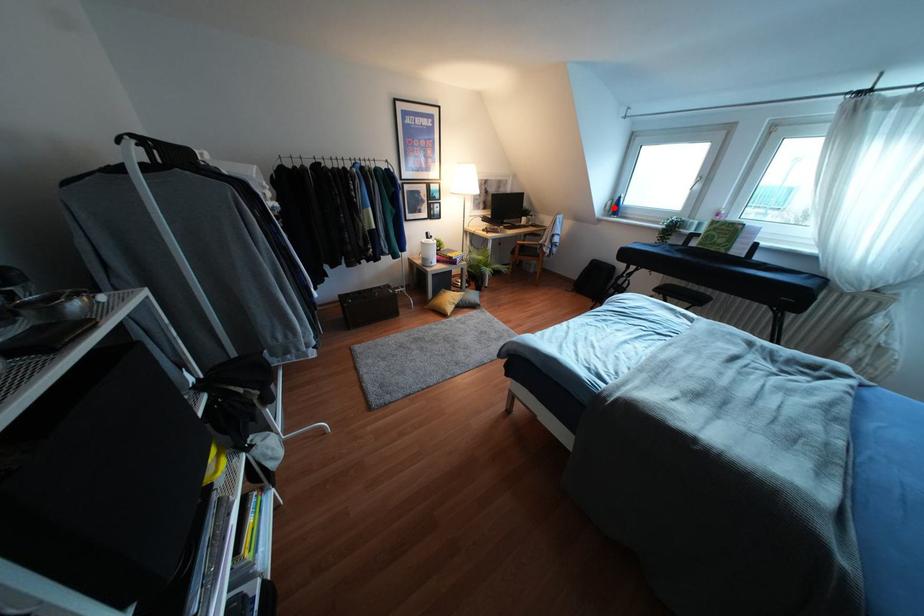
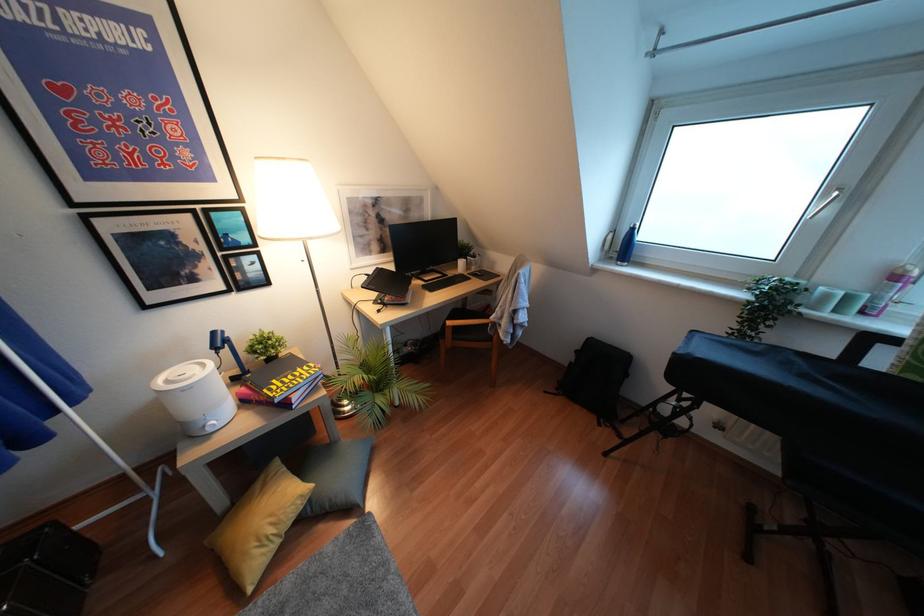
Where in the second image is the point corresponding to the highlighted location from the first image?

(623, 246)